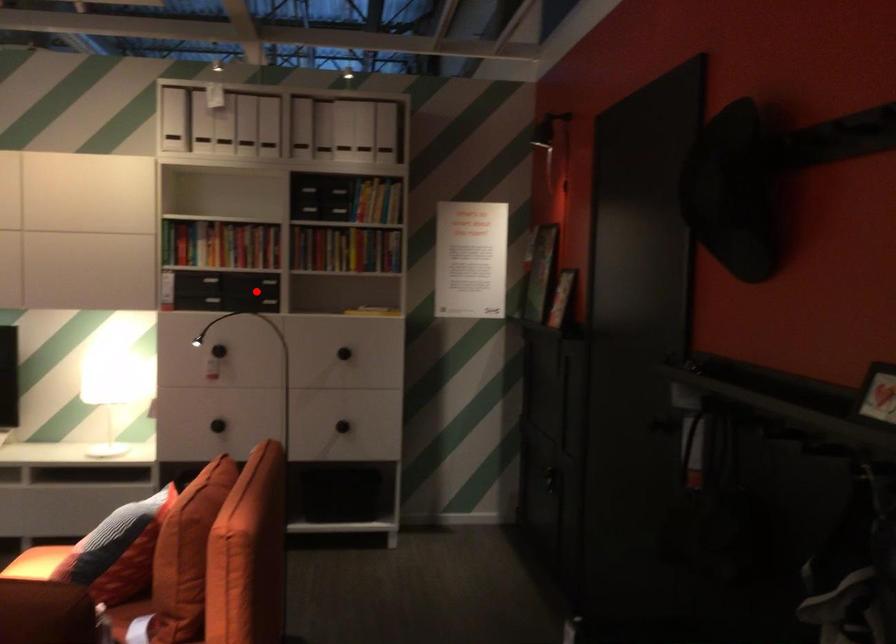
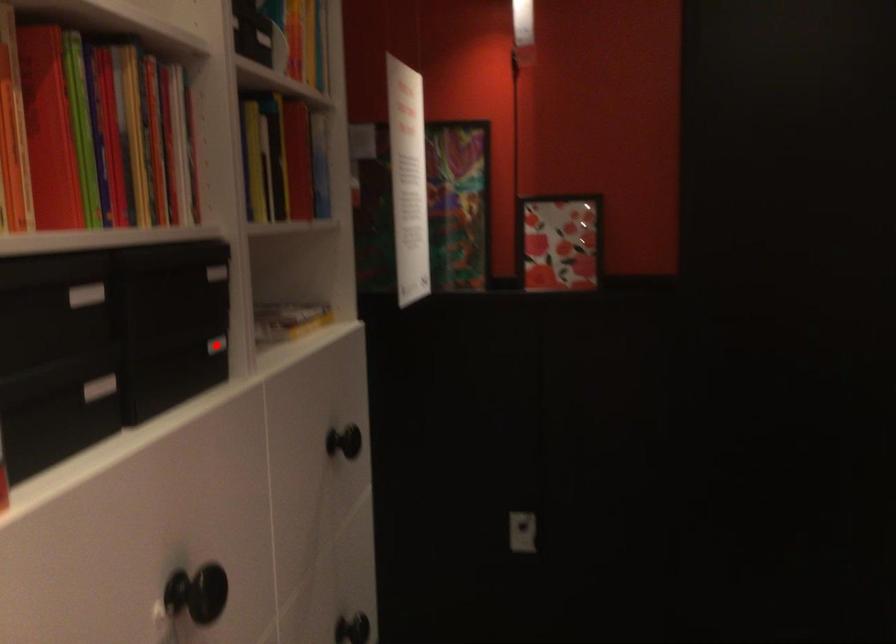
I am providing you with two images of the same scene from different viewpoints. A red point is marked on the first image and another point is marked on the second image. Do the highlighted points in image1 and image2 indicate the same real-world spot?

Yes